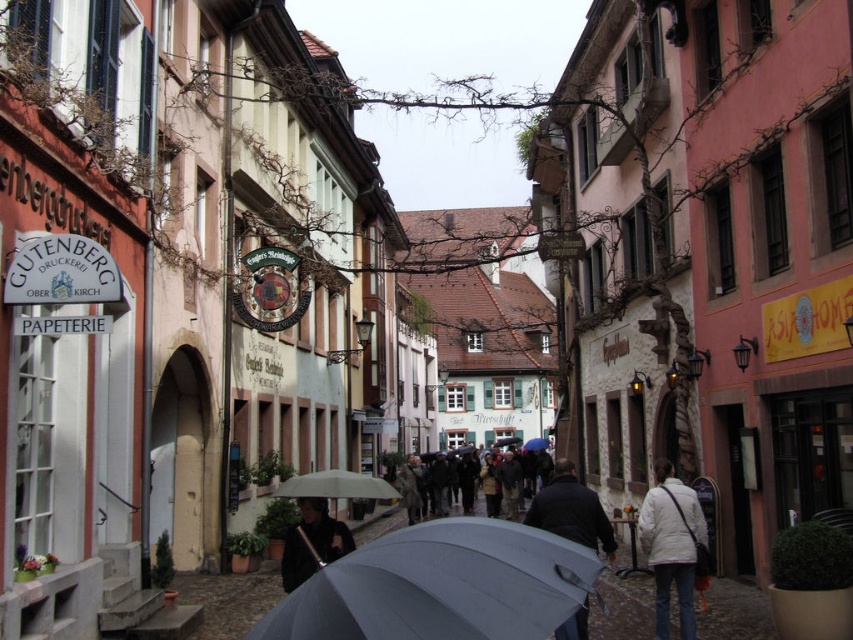
Which is above, black matte coat at center or gray matte umbrella at center?

black matte coat at center

What do you see at coordinates (312, 541) in the screenshot? I see `black matte coat at center` at bounding box center [312, 541].

Does point (326, 556) come in front of point (347, 476)?

That is True.

I want to click on black matte coat at center, so click(x=312, y=541).

Is matte gray umbrella at center taller than dark gray coat at center?

Incorrect, matte gray umbrella at center's height is not larger of dark gray coat at center's.

This screenshot has width=853, height=640. I want to click on matte gray umbrella at center, so click(440, 586).

I want to click on matte gray umbrella at center, so click(440, 586).

Does dark gray fabric umbrella at center have a lesser width compared to black matte coat at center?

Yes, dark gray fabric umbrella at center is thinner than black matte coat at center.

Is point (556, 497) positioned behind point (311, 547)?

That is True.

The height and width of the screenshot is (640, 853). I want to click on dark gray fabric umbrella at center, so click(x=572, y=509).

Find the location of a particular element. The width and height of the screenshot is (853, 640). dark gray fabric umbrella at center is located at coordinates (572, 509).